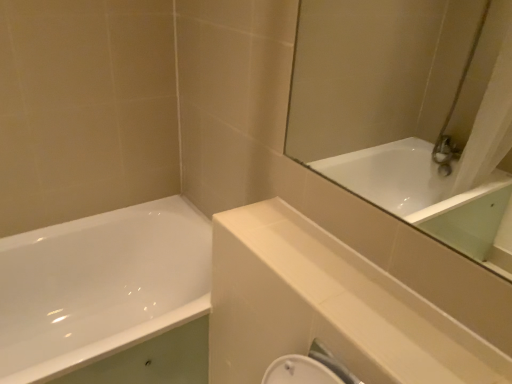
Question: From a real-world perspective, is white glossy balustrade at upper center physically located above or below white glossy bathtub at left?

Choices:
 (A) below
 (B) above

Answer: (B)

Question: Would you say white glossy balustrade at upper center is inside or outside white glossy bathtub at left?

Choices:
 (A) outside
 (B) inside

Answer: (A)

Question: In terms of width, does white glossy balustrade at upper center look wider or thinner when compared to white glossy bathtub at left?

Choices:
 (A) wide
 (B) thin

Answer: (B)

Question: Visually, is white glossy bathtub at left positioned to the left or to the right of white glossy balustrade at upper center?

Choices:
 (A) left
 (B) right

Answer: (A)

Question: Which is correct: white glossy bathtub at left is inside white glossy balustrade at upper center, or outside of it?

Choices:
 (A) inside
 (B) outside

Answer: (B)

Question: Is white glossy bathtub at left taller or shorter than white glossy balustrade at upper center?

Choices:
 (A) short
 (B) tall

Answer: (B)

Question: In terms of size, does white glossy bathtub at left appear bigger or smaller than white glossy balustrade at upper center?

Choices:
 (A) big
 (B) small

Answer: (A)